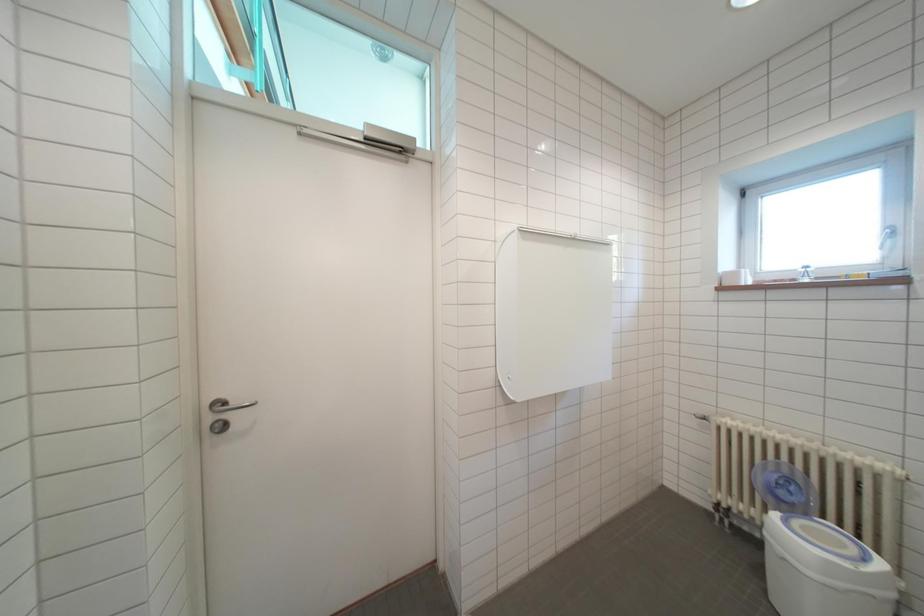
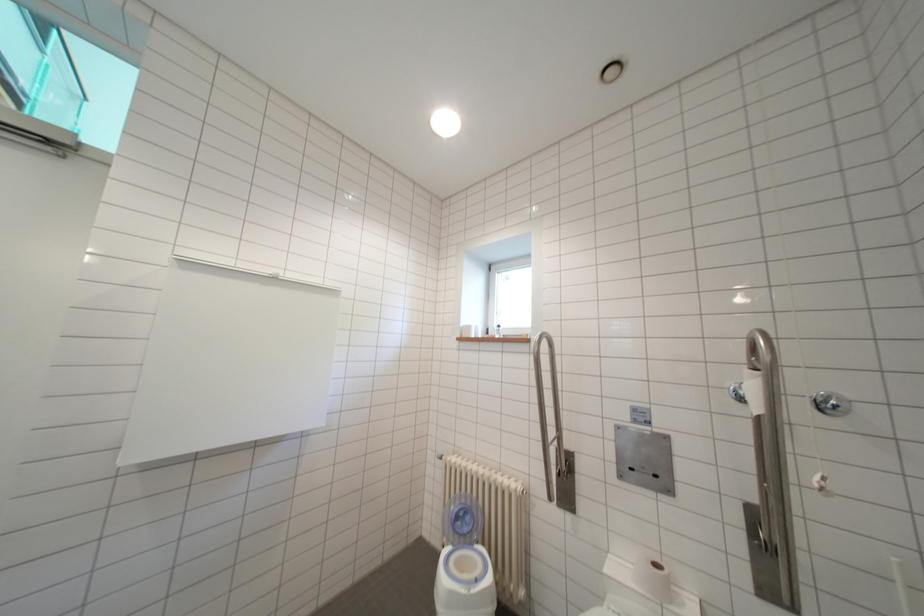
Question: What movement of the cameraman would produce the second image?

Choices:
 (A) Left
 (B) Right
 (C) Forward
 (D) Backward

Answer: (B)